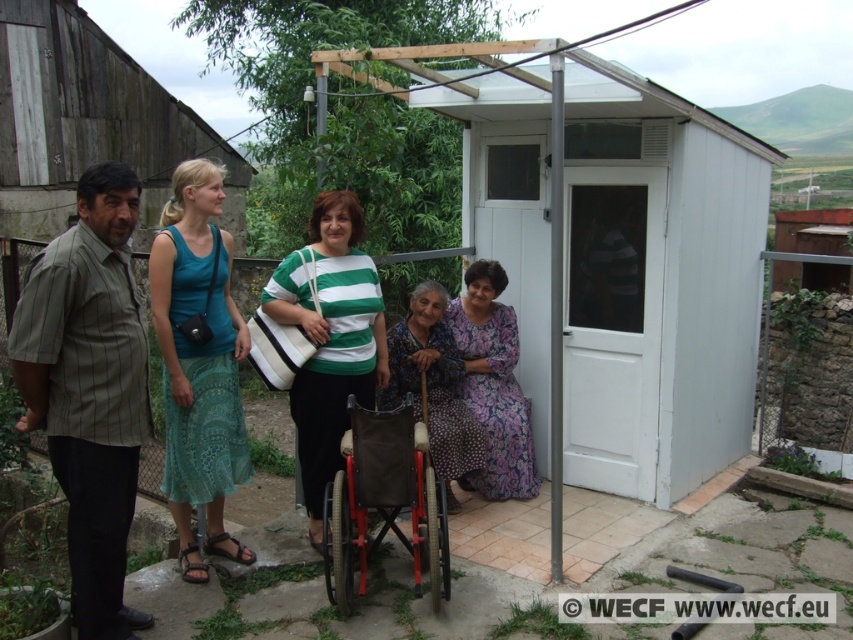
Does white plastic hut at center have a lesser height compared to green striped shirt at center?

No.

Between white plastic hut at center and green striped shirt at center, which one appears on the right side from the viewer's perspective?

white plastic hut at center is more to the right.

Does point (668, 394) lie in front of point (334, 252)?

No, (668, 394) is behind (334, 252).

Identify the location of white plastic hut at center. (608, 253).

Does green striped shirt at center have a larger size compared to printed fabric dress at center?

Yes.

Based on the photo, does green striped shirt at center appear on the right side of printed fabric dress at center?

No, green striped shirt at center is not to the right of printed fabric dress at center.

Identify the location of green striped shirt at center. (329, 339).

This screenshot has width=853, height=640. In order to click on green striped shirt at center in this screenshot , I will do `click(329, 339)`.

Who is taller, striped fabric shirt at left or red metal wheelchair at center?

With more height is striped fabric shirt at left.

Is point (30, 368) positioned before point (426, 465)?

Yes, it is.

Does point (70, 536) lie behind point (399, 477)?

No, it is not.

Where is `striped fabric shirt at left`? striped fabric shirt at left is located at coordinates (88, 388).